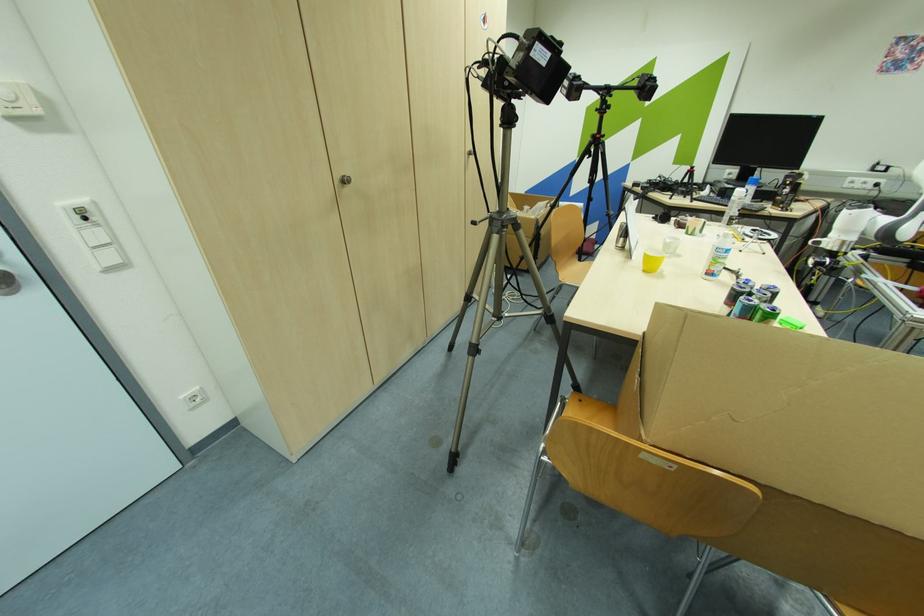
Describe the element at coordinates (8, 97) in the screenshot. This screenshot has width=924, height=616. I see `a rocker light switch` at that location.